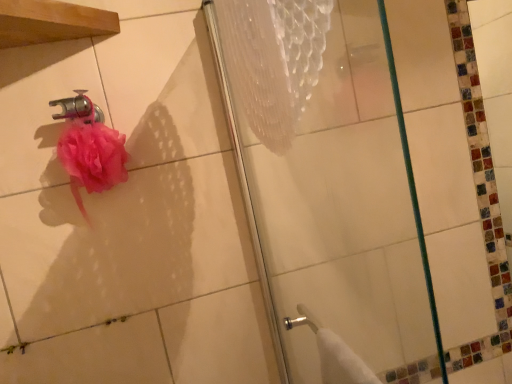
Question: Does pink fluffy sponge at upper left have a lesser height compared to polished chrome faucet at upper left?

Choices:
 (A) no
 (B) yes

Answer: (A)

Question: Does pink fluffy sponge at upper left have a smaller size compared to polished chrome faucet at upper left?

Choices:
 (A) yes
 (B) no

Answer: (B)

Question: Does pink fluffy sponge at upper left lie behind polished chrome faucet at upper left?

Choices:
 (A) yes
 (B) no

Answer: (B)

Question: Does pink fluffy sponge at upper left have a greater width compared to polished chrome faucet at upper left?

Choices:
 (A) no
 (B) yes

Answer: (B)

Question: Does pink fluffy sponge at upper left appear on the right side of polished chrome faucet at upper left?

Choices:
 (A) yes
 (B) no

Answer: (A)

Question: From a real-world perspective, is pink fluffy sponge at upper left physically above polished chrome faucet at upper left?

Choices:
 (A) yes
 (B) no

Answer: (B)

Question: Does transparent glass shower door at center have a greater width compared to polished chrome faucet at upper left?

Choices:
 (A) yes
 (B) no

Answer: (B)

Question: Is transparent glass shower door at center positioned beyond the bounds of polished chrome faucet at upper left?

Choices:
 (A) no
 (B) yes

Answer: (B)

Question: Does transparent glass shower door at center have a greater height compared to polished chrome faucet at upper left?

Choices:
 (A) no
 (B) yes

Answer: (B)

Question: Is transparent glass shower door at center next to polished chrome faucet at upper left?

Choices:
 (A) yes
 (B) no

Answer: (B)

Question: From the image's perspective, does transparent glass shower door at center appear lower than polished chrome faucet at upper left?

Choices:
 (A) yes
 (B) no

Answer: (A)

Question: Is transparent glass shower door at center positioned with its back to polished chrome faucet at upper left?

Choices:
 (A) yes
 (B) no

Answer: (A)

Question: Does polished chrome faucet at upper left appear on the left side of transparent glass shower door at center?

Choices:
 (A) no
 (B) yes

Answer: (B)